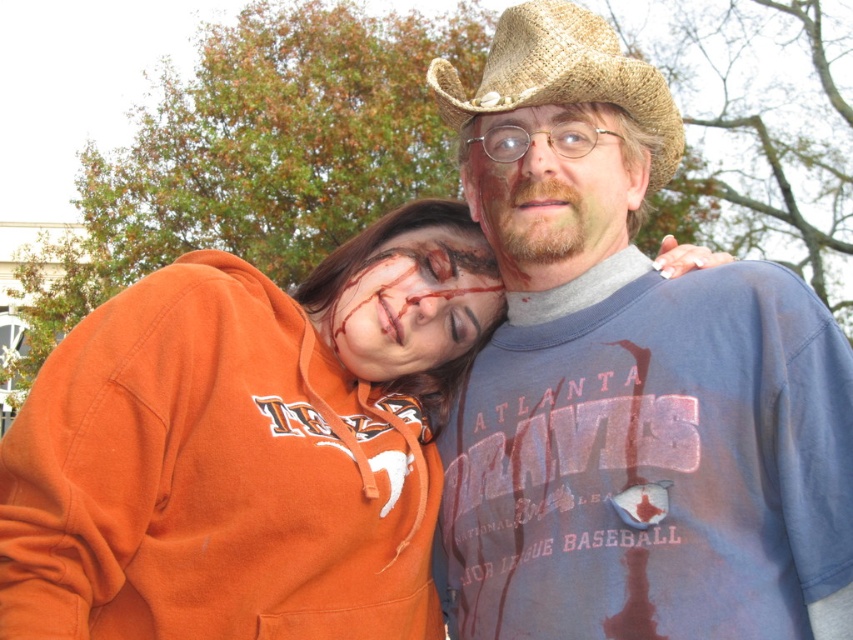
Question: Does matte orange hoodie at center appear on the left side of brown straw cowboy hat at upper center?

Choices:
 (A) yes
 (B) no

Answer: (A)

Question: Observing the image, what is the correct spatial positioning of orange fleece hoodie at center in reference to brown straw cowboy hat at upper center?

Choices:
 (A) above
 (B) below

Answer: (B)

Question: Which point appears farthest from the camera in this image?

Choices:
 (A) (639, 177)
 (B) (494, 317)

Answer: (B)

Question: Considering the real-world distances, which object is farthest from the blue cotton t-shirt at center?

Choices:
 (A) orange fleece hoodie at center
 (B) brown straw cowboy hat at upper center

Answer: (A)

Question: Can you confirm if matte orange hoodie at center is positioned to the left of brown straw cowboy hat at upper center?

Choices:
 (A) yes
 (B) no

Answer: (A)

Question: Which point is farther to the camera?

Choices:
 (A) matte orange hoodie at center
 (B) matte brown cowboy hat at center

Answer: (A)